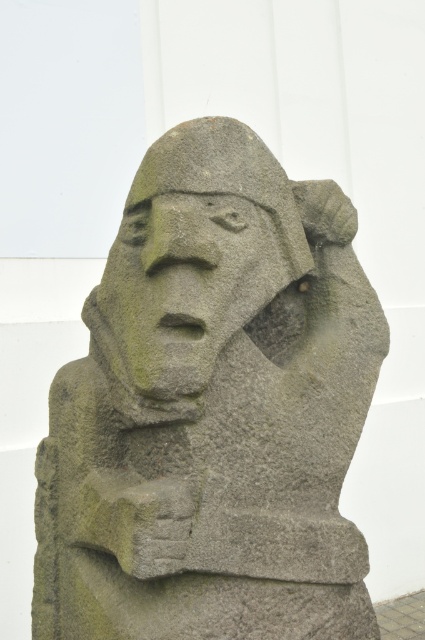
You are standing at the center of the image. Where is the gray stone statue at center located relative to your position?

The gray stone statue at center is located at point (212, 410) relative to the center of the image.

From the picture: You are an archaeologist examining the image. You notice two objects labeled as the gray stone statue at center and the green stone face at center. From your vantage point, which one appears closer to you?

The gray stone statue at center is in front of the green stone face at center, so the gray stone statue at center appears closer to you.

You are a photographer standing at a certain position. You want to take a photo of the gray stone statue at center. According to the description, what is the minimum distance you need to maintain between yourself and the statue to ensure the entire statue fits in the frame?

The minimum distance you need to maintain between yourself and the gray stone statue at center is 2.15 meters, as this is the distance specified between the camera and the statue.